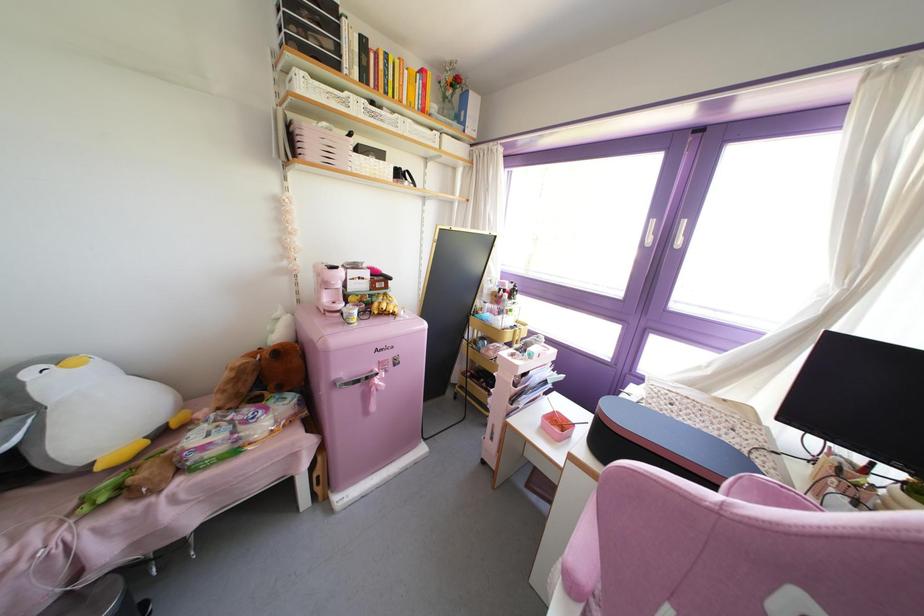
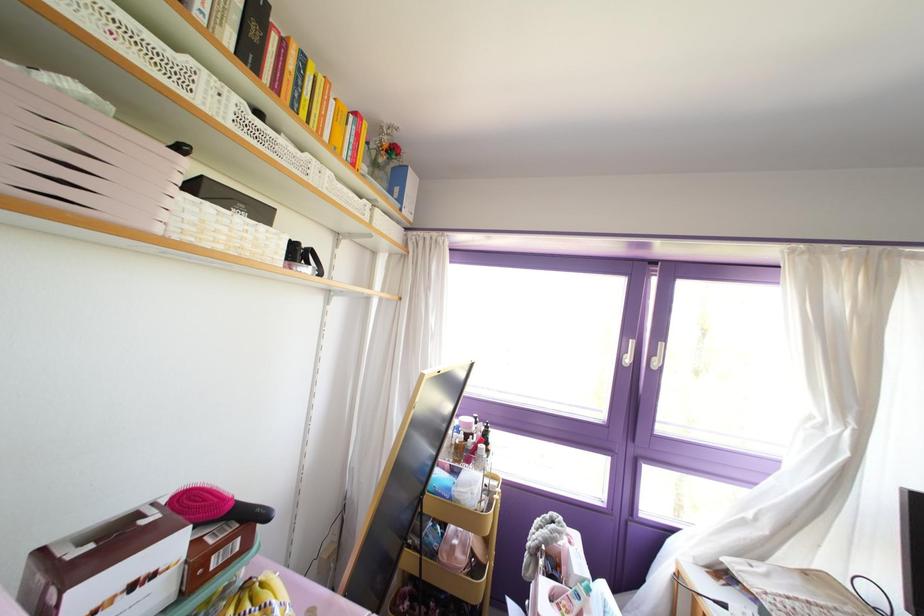
In the second image, find the point that corresponds to the point at 385,278 in the first image.

(251, 517)